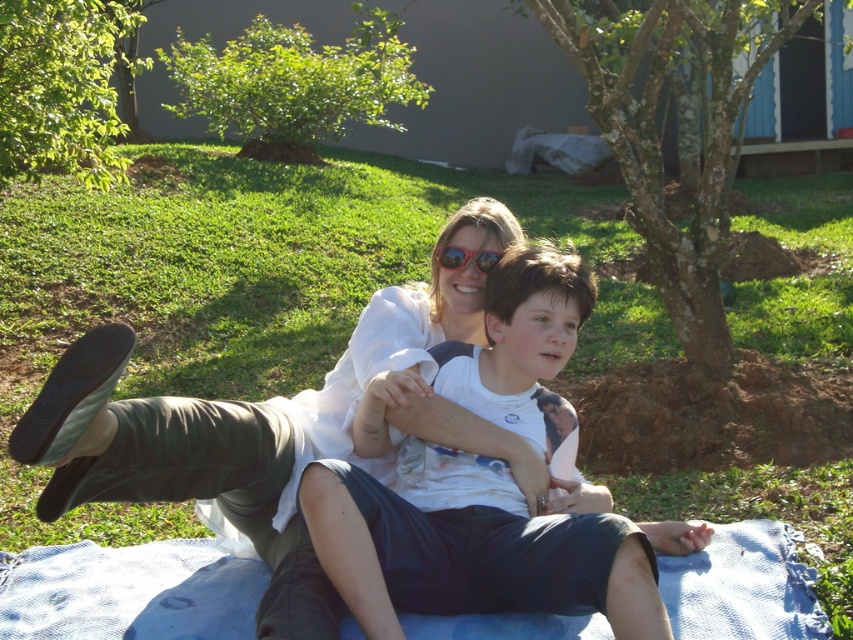
Question: Among these points, which one is nearest to the camera?

Choices:
 (A) (497, 259)
 (B) (552, 604)
 (C) (44, 547)

Answer: (B)

Question: Does white cotton shirt at center have a greater width compared to shiny red sunglasses at center?

Choices:
 (A) no
 (B) yes

Answer: (B)

Question: Which object is positioned farthest from the blue woven blanket at lower center?

Choices:
 (A) shiny red sunglasses at center
 (B) white cotton shirt at center

Answer: (A)

Question: Which object is the farthest from the white cotton shirt at center?

Choices:
 (A) blue woven blanket at lower center
 (B) shiny red sunglasses at center

Answer: (A)

Question: Is blue woven blanket at lower center thinner than shiny red sunglasses at center?

Choices:
 (A) no
 (B) yes

Answer: (A)

Question: Does white cotton shirt at center have a larger size compared to shiny red sunglasses at center?

Choices:
 (A) yes
 (B) no

Answer: (A)